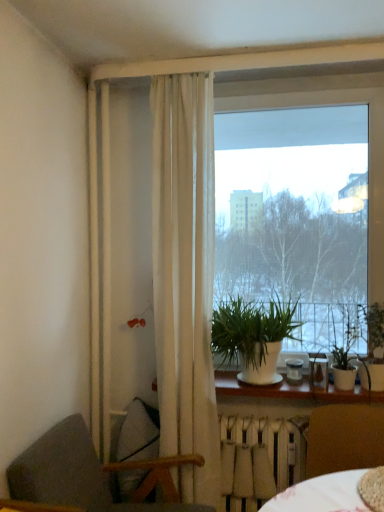
Question: Considering the relative positions of white matte plant at center, the 1th houseplant from the left, and dark gray fabric chair at lower left, the 1th chair from the left, in the image provided, is white matte plant at center, the 1th houseplant from the left, behind dark gray fabric chair at lower left, the 1th chair from the left,?

Choices:
 (A) yes
 (B) no

Answer: (A)

Question: Is dark gray fabric chair at lower left, the 1th chair from the left, at the back of white matte plant at center, the 1th houseplant from the left?

Choices:
 (A) no
 (B) yes

Answer: (A)

Question: Does white matte plant at center, the 3th houseplant positioned from the right, have a smaller size compared to dark gray fabric chair at lower left, the 1th chair from the left?

Choices:
 (A) no
 (B) yes

Answer: (B)

Question: Is there a large distance between white matte plant at center, the 1th houseplant from the left, and dark gray fabric chair at lower left, the 1th chair from the left?

Choices:
 (A) yes
 (B) no

Answer: (B)

Question: From a real-world perspective, is white matte plant at center, the 1th houseplant from the left, positioned under dark gray fabric chair at lower left, the second chair from the right, based on gravity?

Choices:
 (A) no
 (B) yes

Answer: (A)

Question: From the image's perspective, relative to transparent glass window at center, is green matte plant at right, acting as the second houseplant starting from the left, above or below?

Choices:
 (A) below
 (B) above

Answer: (A)

Question: From their relative heights in the image, would you say green matte plant at right, the second houseplant in the right-to-left sequence, is taller or shorter than transparent glass window at center?

Choices:
 (A) tall
 (B) short

Answer: (B)

Question: Is green matte plant at right, the second houseplant in the right-to-left sequence, in front of or behind transparent glass window at center in the image?

Choices:
 (A) front
 (B) behind

Answer: (A)

Question: From a real-world perspective, relative to transparent glass window at center, is green matte plant at right, acting as the second houseplant starting from the left, vertically above or below?

Choices:
 (A) above
 (B) below

Answer: (B)

Question: Is brown leather chair at lower right, which ranks as the second chair in left-to-right order, inside or outside of transparent glass window at center?

Choices:
 (A) outside
 (B) inside

Answer: (A)

Question: From their relative heights in the image, would you say brown leather chair at lower right, which ranks as the second chair in left-to-right order, is taller or shorter than transparent glass window at center?

Choices:
 (A) short
 (B) tall

Answer: (A)

Question: From the image's perspective, is brown leather chair at lower right, placed as the first chair when sorted from right to left, located above or below transparent glass window at center?

Choices:
 (A) above
 (B) below

Answer: (B)

Question: Based on their sizes in the image, would you say brown leather chair at lower right, placed as the first chair when sorted from right to left, is bigger or smaller than transparent glass window at center?

Choices:
 (A) small
 (B) big

Answer: (A)

Question: Is white wood window sill at lower center to the left or to the right of white matte radiator at lower center in the image?

Choices:
 (A) right
 (B) left

Answer: (A)

Question: Is point (283, 376) positioned closer to the camera than point (256, 495)?

Choices:
 (A) closer
 (B) farther

Answer: (B)